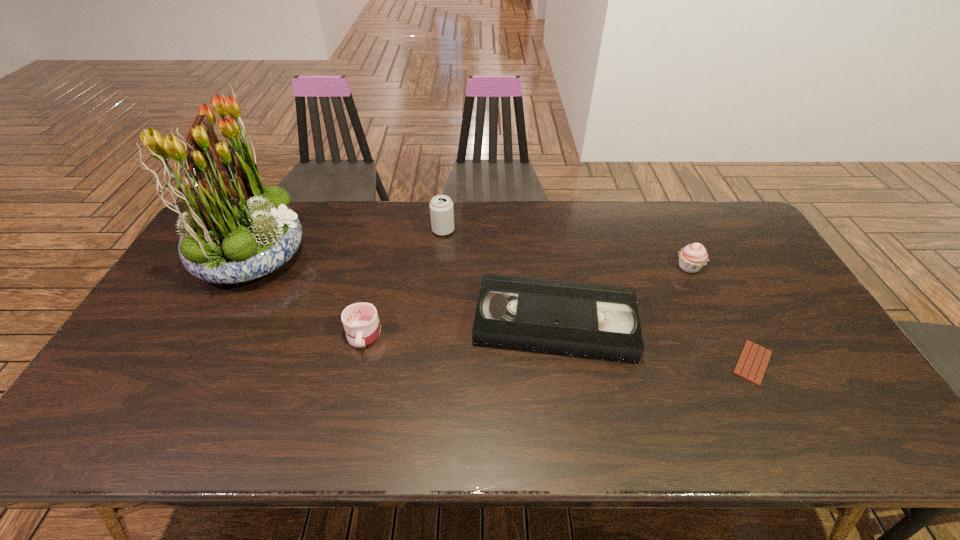
Locate an element on the screen. vacant space located on the front-facing side of the tallest object is located at coordinates (359, 254).

You are a GUI agent. You are given a task and a screenshot of the screen. Output one action in this format:
    pyautogui.click(x=<x>, y=<y>)
    Task: Click on the vacant space located 0.220m on the front of the fifth shortest object
    This screenshot has height=540, width=960.
    Given the screenshot: What is the action you would take?
    pyautogui.click(x=438, y=284)

Find the location of a particular element. free spot located on the right of the fourth shortest object is located at coordinates (777, 267).

At what (x,y) coordinates should I click in order to perform the action: click on vacant area situated 0.110m on the side with the handle of the fifth object from right to left. Please return your answer as a coordinate pair (x, y). The image size is (960, 540). Looking at the image, I should click on (350, 392).

The height and width of the screenshot is (540, 960). I want to click on blank space located on the front of the third object from right to left, so click(572, 440).

Image resolution: width=960 pixels, height=540 pixels. I want to click on free spot located on the back of the shortest object, so click(x=692, y=246).

Find the location of a particular element. This screenshot has height=540, width=960. flower arrangement that is at the far edge is located at coordinates (236, 230).

Image resolution: width=960 pixels, height=540 pixels. I want to click on can positioned at the far edge, so click(x=441, y=207).

Locate an element on the screen. object at the left edge is located at coordinates (236, 230).

Locate an element on the screen. object located in the far left corner section of the desktop is located at coordinates (236, 230).